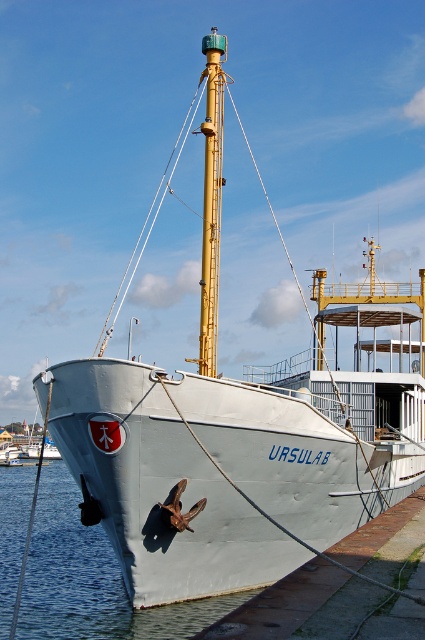
Is metallic gray water at lower left above yellow metallic mast at center?

No, metallic gray water at lower left is not above yellow metallic mast at center.

Where is `metallic gray water at lower left`? The width and height of the screenshot is (425, 640). metallic gray water at lower left is located at coordinates (91, 579).

Where is `metallic gray water at lower left`? The width and height of the screenshot is (425, 640). metallic gray water at lower left is located at coordinates (91, 579).